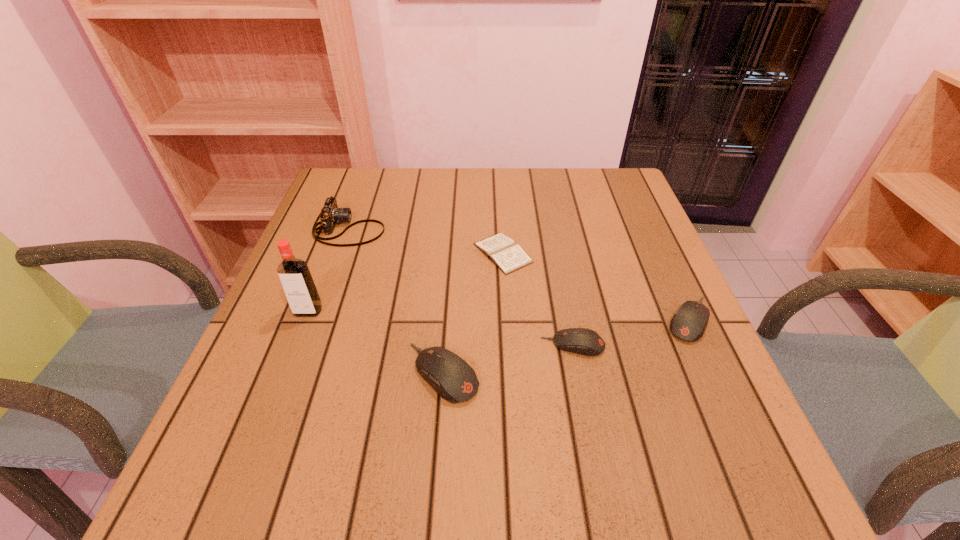
Where is `free spot between the shortest computer mouse and the fourth tallest object`? free spot between the shortest computer mouse and the fourth tallest object is located at coordinates (631, 332).

Locate an element on the screen. free point between the vodka and the leftmost computer mouse is located at coordinates (375, 342).

Identify the location of free space between the second shortest object and the second shortest computer mouse. The height and width of the screenshot is (540, 960). (631, 332).

The image size is (960, 540). Find the location of `free space between the second shortest object and the camera`. free space between the second shortest object and the camera is located at coordinates (461, 287).

Locate an element on the screen. vacant region between the tallest object and the diary is located at coordinates (405, 282).

You are a GUI agent. You are given a task and a screenshot of the screen. Output one action in this format:
    pyautogui.click(x=<x>, y=<y>)
    Task: Click on the object that stands as the closest to the diary
    The height and width of the screenshot is (540, 960).
    Given the screenshot: What is the action you would take?
    pyautogui.click(x=583, y=341)

Locate an element on the screen. Image resolution: width=960 pixels, height=540 pixels. object that is the third closest to the diary is located at coordinates (330, 214).

Choose which computer mouse is the second nearest neighbor to the camera. Please provide its 2D coordinates. Your answer should be formatted as a tuple, i.e. [(x, y)], where the tuple contains the x and y coordinates of a point satisfying the conditions above.

[(583, 341)]

What are the coordinates of `computer mouse object that ranks as the third closest to the camera` in the screenshot? It's located at (689, 322).

At what (x,y) coordinates should I click in order to perform the action: click on vacant region that satisfies the following two spatial constraints: 1. on the front-facing side of the third shortest object; 2. on the left side of the camera. Please return your answer as a coordinate pair (x, y). Image resolution: width=960 pixels, height=540 pixels. Looking at the image, I should click on (317, 320).